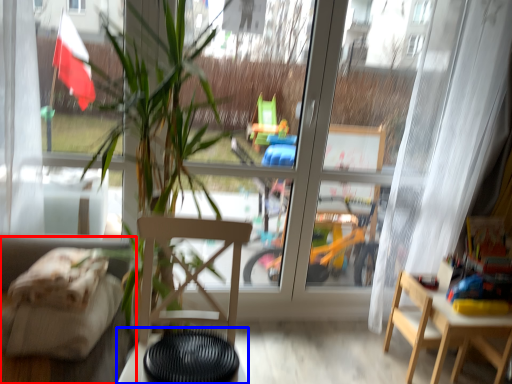
Question: Which point is closer to the camera, couch (highlighted by a red box) or table (highlighted by a blue box)?

Choices:
 (A) couch
 (B) table

Answer: (A)